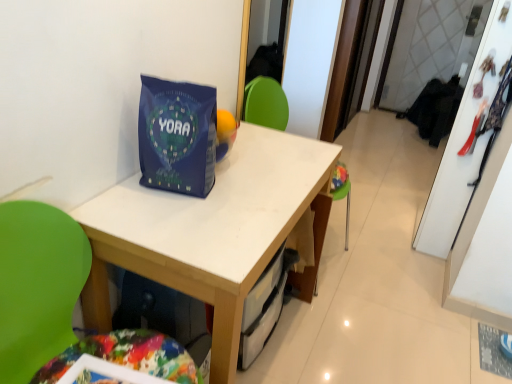
Image resolution: width=512 pixels, height=384 pixels. I want to click on free spot in front of blue matte gift bag at center, so click(x=149, y=218).